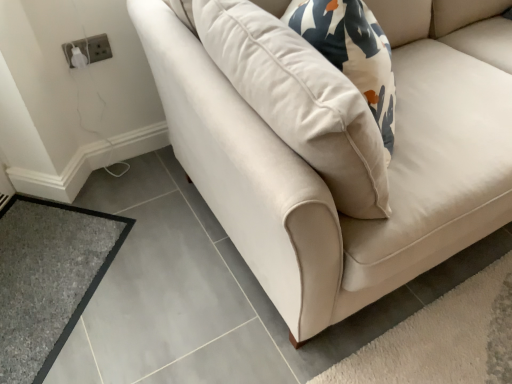
Where is `gray carpet at lower left`? The width and height of the screenshot is (512, 384). gray carpet at lower left is located at coordinates (48, 278).

Describe the element at coordinates (48, 278) in the screenshot. This screenshot has height=384, width=512. I see `gray carpet at lower left` at that location.

At what (x,y) coordinates should I click in order to perform the action: click on white plastic socket at upper left. Please return your answer as a coordinate pair (x, y). The image size is (512, 384). Looking at the image, I should click on (89, 49).

What do you see at coordinates (89, 49) in the screenshot? The width and height of the screenshot is (512, 384). I see `white plastic socket at upper left` at bounding box center [89, 49].

This screenshot has width=512, height=384. Find the location of `gray carpet at lower left`. gray carpet at lower left is located at coordinates (48, 278).

Visually, is gray carpet at lower left positioned to the left or to the right of white plastic socket at upper left?

gray carpet at lower left is to the left of white plastic socket at upper left.

Consider the image. Considering their positions, is gray carpet at lower left located in front of or behind white plastic socket at upper left?

In the image, gray carpet at lower left appears in front of white plastic socket at upper left.

Is point (8, 349) closer to camera compared to point (86, 47)?

That is True.

From the image's perspective, is gray carpet at lower left under white plastic socket at upper left?

Yes.

From a real-world perspective, is gray carpet at lower left located beneath white plastic socket at upper left?

Yes, from a real-world perspective, gray carpet at lower left is beneath white plastic socket at upper left.

In terms of width, does gray carpet at lower left look wider or thinner when compared to white plastic socket at upper left?

Considering their sizes, gray carpet at lower left looks broader than white plastic socket at upper left.

Between gray carpet at lower left and white plastic socket at upper left, which one has more height?

With more height is white plastic socket at upper left.

Who is bigger, gray carpet at lower left or white plastic socket at upper left?

gray carpet at lower left is bigger.

Is gray carpet at lower left inside or outside of white plastic socket at upper left?

gray carpet at lower left is not inside white plastic socket at upper left, it's outside.

Would you say gray carpet at lower left is a long distance from white plastic socket at upper left?

No, gray carpet at lower left is in close proximity to white plastic socket at upper left.

Is white plastic socket at upper left at the back of gray carpet at lower left?

No, gray carpet at lower left is not facing the opposite direction of white plastic socket at upper left.

Can you tell me how much gray carpet at lower left and white plastic socket at upper left differ in facing direction?

gray carpet at lower left and white plastic socket at upper left are facing 44.5 degrees away from each other.

From the picture: Measure the distance between gray carpet at lower left and white plastic socket at upper left.

26.69 inches.

At what (x,y) coordinates should I click in order to perform the action: click on electric outlet that is on the right side of gray carpet at lower left. Please return your answer as a coordinate pair (x, y). Looking at the image, I should click on (89, 49).

Can you confirm if white plastic socket at upper left is positioned to the left of gray carpet at lower left?

Incorrect, white plastic socket at upper left is not on the left side of gray carpet at lower left.

Looking at this image, who is more distant, white plastic socket at upper left or gray carpet at lower left?

white plastic socket at upper left.

Does point (69, 62) come farther from viewer compared to point (10, 375)?

Yes.

From the image's perspective, which is below, white plastic socket at upper left or gray carpet at lower left?

gray carpet at lower left appears lower in the image.

From a real-world perspective, which object stands above the other?

A: white plastic socket at upper left.

Considering the sizes of objects white plastic socket at upper left and gray carpet at lower left in the image provided, who is wider, white plastic socket at upper left or gray carpet at lower left?

gray carpet at lower left is wider.

Considering the sizes of objects white plastic socket at upper left and gray carpet at lower left in the image provided, who is taller, white plastic socket at upper left or gray carpet at lower left?

Standing taller between the two is white plastic socket at upper left.

Considering the sizes of objects white plastic socket at upper left and gray carpet at lower left in the image provided, who is smaller, white plastic socket at upper left or gray carpet at lower left?

white plastic socket at upper left is smaller.

Can we say white plastic socket at upper left lies outside gray carpet at lower left?

white plastic socket at upper left is positioned outside gray carpet at lower left.

Would you consider white plastic socket at upper left to be distant from gray carpet at lower left?

No, there isn't a large distance between white plastic socket at upper left and gray carpet at lower left.

Is white plastic socket at upper left oriented towards gray carpet at lower left?

No, white plastic socket at upper left is not aimed at gray carpet at lower left.

How different are the orientations of white plastic socket at upper left and gray carpet at lower left in degrees?

There is a 44.5-degree angle between the facing directions of white plastic socket at upper left and gray carpet at lower left.

Locate an element on the screen. This screenshot has width=512, height=384. electric outlet to the right of gray carpet at lower left is located at coordinates (89, 49).

In the image, there is a white plastic socket at upper left. At what (x,y) coordinates should I click in order to perform the action: click on mat below it (from a real-world perspective). Please return your answer as a coordinate pair (x, y). Looking at the image, I should click on (48, 278).

This screenshot has width=512, height=384. What are the coordinates of `mat below the white plastic socket at upper left (from the image's perspective)` in the screenshot? It's located at (48, 278).